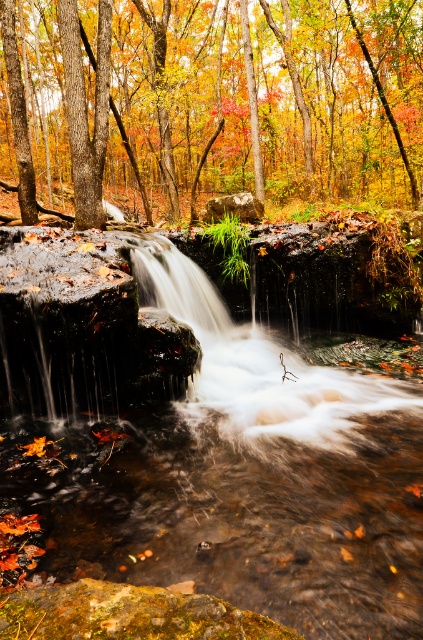
Question: Which is farther from the autumn leaves at center?

Choices:
 (A) smooth stone waterfall at center
 (B) translucent water at center

Answer: (B)

Question: Can you confirm if translucent water at center is thinner than autumn leaves at center?

Choices:
 (A) yes
 (B) no

Answer: (A)

Question: Which of the following is the closest to the observer?

Choices:
 (A) (241, 419)
 (B) (134, 572)

Answer: (B)

Question: Can you confirm if autumn leaves at center is smaller than smooth stone waterfall at center?

Choices:
 (A) yes
 (B) no

Answer: (B)

Question: Which of the following is the closest to the observer?

Choices:
 (A) (258, 352)
 (B) (390, 124)

Answer: (A)

Question: From the image, what is the correct spatial relationship of translucent water at center in relation to smooth stone waterfall at center?

Choices:
 (A) above
 (B) below

Answer: (B)